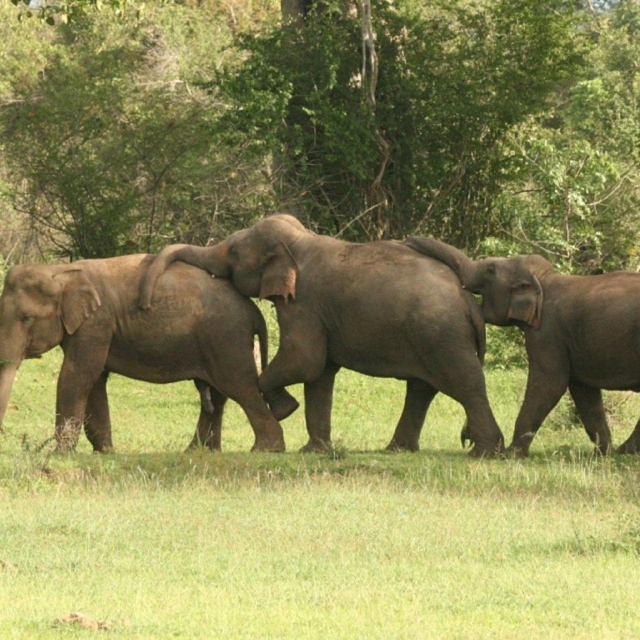
Who is higher up, green leafy tree at upper center or gray matte elephant legs at center?

green leafy tree at upper center is higher up.

Measure the distance from green leafy tree at upper center to gray matte elephant legs at center.

green leafy tree at upper center is 12.40 meters away from gray matte elephant legs at center.

Does point (445, 236) come closer to viewer compared to point (611, 499)?

That is False.

This screenshot has height=640, width=640. In order to click on green leafy tree at upper center in this screenshot , I will do `click(324, 122)`.

Does gray matte elephant at center have a greater height compared to gray textured baby elephant at center?

Yes, gray matte elephant at center is taller than gray textured baby elephant at center.

Based on the photo, who is positioned more to the right, gray matte elephant at center or gray textured baby elephant at center?

Positioned to the right is gray matte elephant at center.

Who is more distant from viewer, (452, 330) or (65, 355)?

Point (65, 355)

Identify the location of gray matte elephant at center. (353, 323).

In the scene shown: Is gray matte elephant at center bigger than gray textured elephant at center?

Yes, gray matte elephant at center is bigger than gray textured elephant at center.

Who is higher up, gray matte elephant at center or gray textured elephant at center?

gray textured elephant at center

Does point (472, 440) come farther from viewer compared to point (620, 376)?

That is True.

Locate an element on the screen. This screenshot has width=640, height=640. gray matte elephant at center is located at coordinates (353, 323).